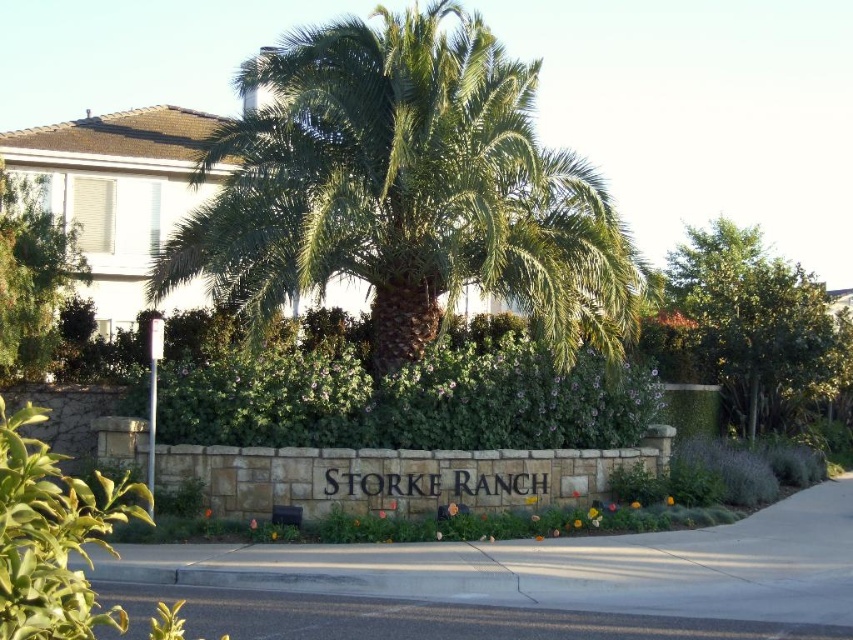
You are standing at the entrance of Storke Ranch and see the green leafy bush at center and the green leafy tree at right. Which one is positioned to the left of the other?

The green leafy bush at center is positioned to the left of the green leafy tree at right.

You are a landscape architect designing a pathway between the green leafy bush at center and the green leafy tree at right. Which object should the pathway be closer to?

The pathway should be closer to the green leafy bush at center because it is shorter than the green leafy tree at right, allowing for better visibility and accessibility.

You are standing at the entrance of Storke Ranch and want to take a photo of the green leafy palm tree at center. If your camera can focus on objects up to 10 meters away, will it be able to capture the tree clearly?

The green leafy palm tree at center is 11.04 meters away from the camera, which is beyond the camera focus range of 10 meters. Therefore, the camera may not capture the tree clearly.